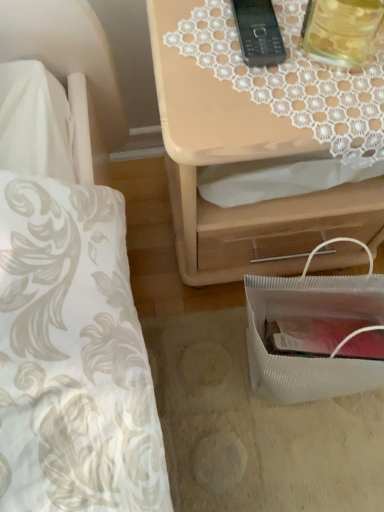
This screenshot has width=384, height=512. What are the coordinates of `free location to the left of translucent glass jar at upper right` in the screenshot? It's located at (230, 74).